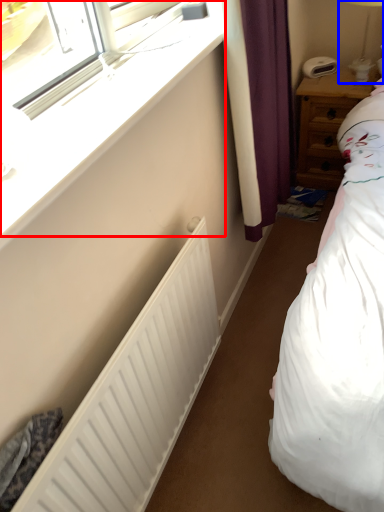
Question: Among these objects, which one is farthest to the camera, window (highlighted by a red box) or bedside lamp (highlighted by a blue box)?

Choices:
 (A) window
 (B) bedside lamp

Answer: (B)